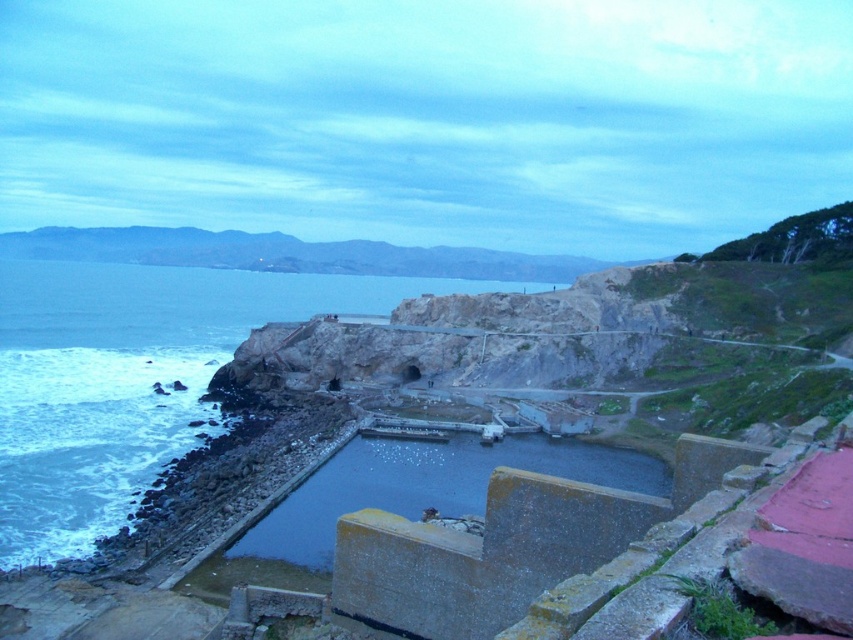
From the picture: Who is higher up, clear blue water at center or dark gray concrete water at center?

clear blue water at center is above.

Is point (45, 397) in front of point (315, 564)?

No, (45, 397) is behind (315, 564).

At what (x,y) coordinates should I click in order to perform the action: click on clear blue water at center. Please return your answer as a coordinate pair (x, y). The height and width of the screenshot is (640, 853). Looking at the image, I should click on (132, 378).